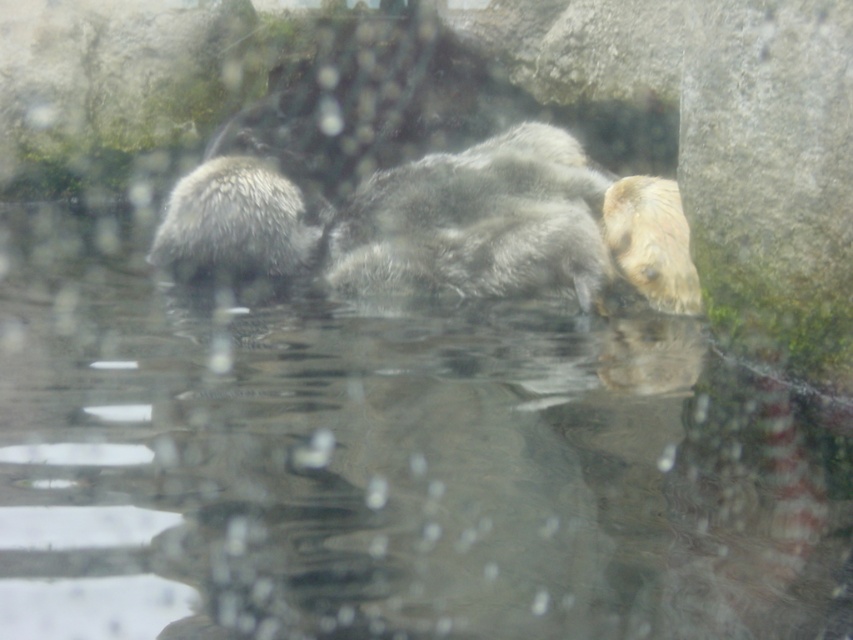
Between clear water at center and fuzzy white otter at left, which one has more height?

Standing taller between the two is clear water at center.

Find the location of a particular element. Image resolution: width=853 pixels, height=640 pixels. clear water at center is located at coordinates (387, 467).